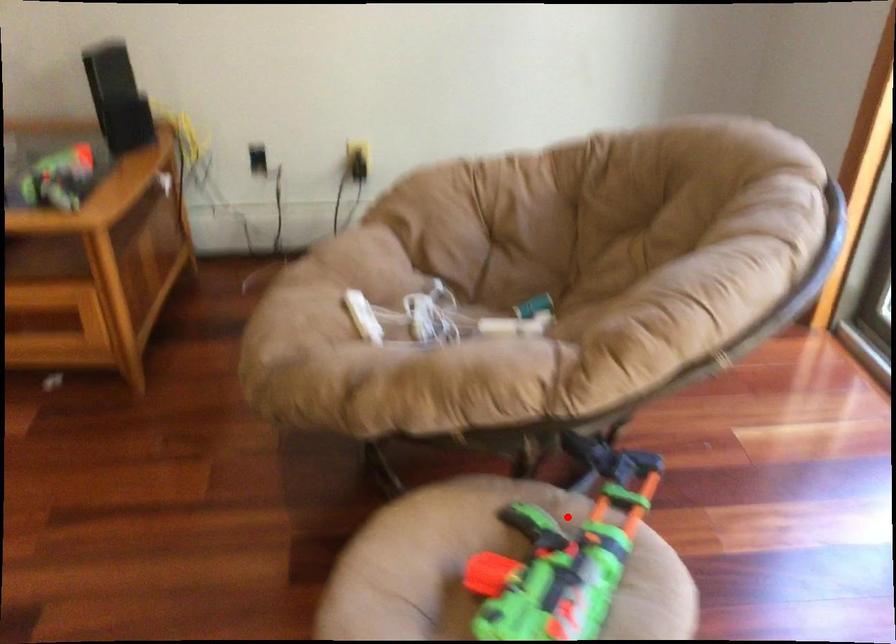
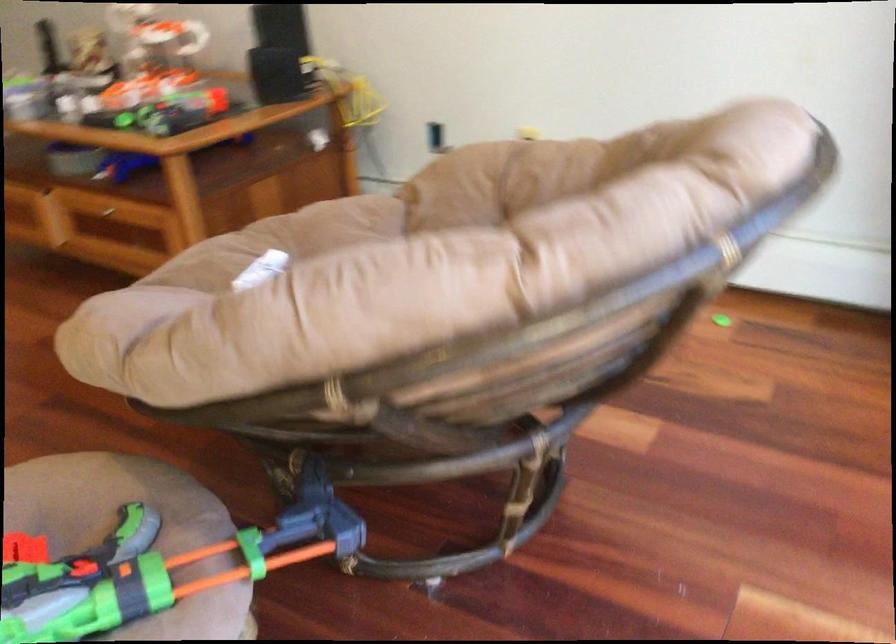
Locate, in the second image, the point that corresponds to the highlighted location in the first image.

(133, 532)